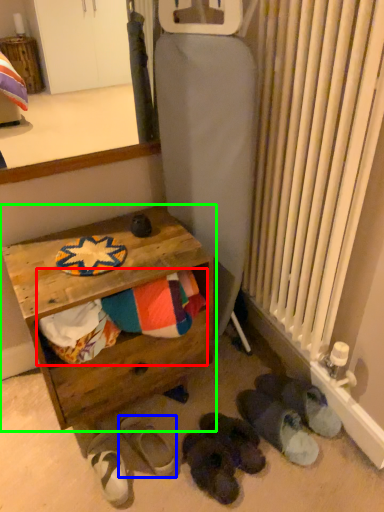
Question: Estimate the real-world distances between objects in this image. Which object is farther from laundry (highlighted by a red box), footwear (highlighted by a blue box) or table (highlighted by a green box)?

Choices:
 (A) footwear
 (B) table

Answer: (A)